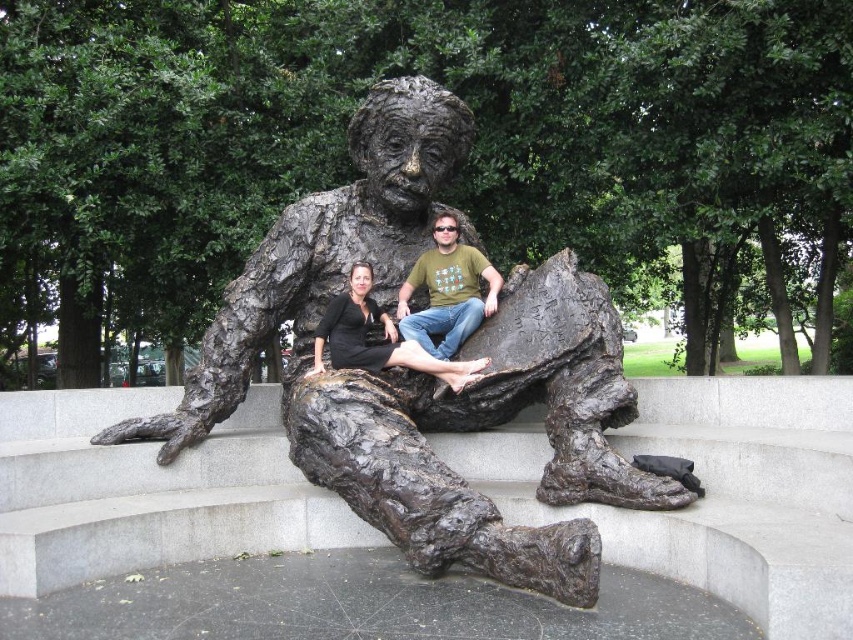
Question: Is bronze statue at center bigger than matte black dress at center?

Choices:
 (A) yes
 (B) no

Answer: (A)

Question: Which point is closer to the camera taking this photo?

Choices:
 (A) (345, 314)
 (B) (332, 484)

Answer: (B)

Question: Can you confirm if bronze statue at center is thinner than matte bronze statue at center?

Choices:
 (A) no
 (B) yes

Answer: (A)

Question: Which point is farther to the camera?

Choices:
 (A) bronze statue at center
 (B) matte black dress at center
 (C) matte bronze statue at center

Answer: (C)

Question: Considering the real-world distances, which object is closest to the bronze statue at center?

Choices:
 (A) matte black dress at center
 (B) matte bronze statue at center

Answer: (A)

Question: Can you confirm if matte bronze statue at center is positioned above matte black dress at center?

Choices:
 (A) no
 (B) yes

Answer: (B)